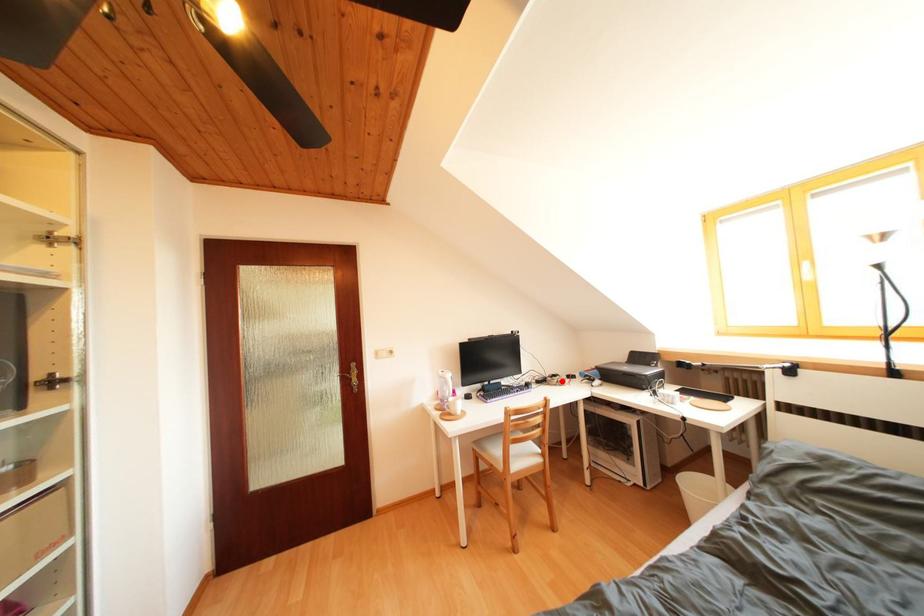
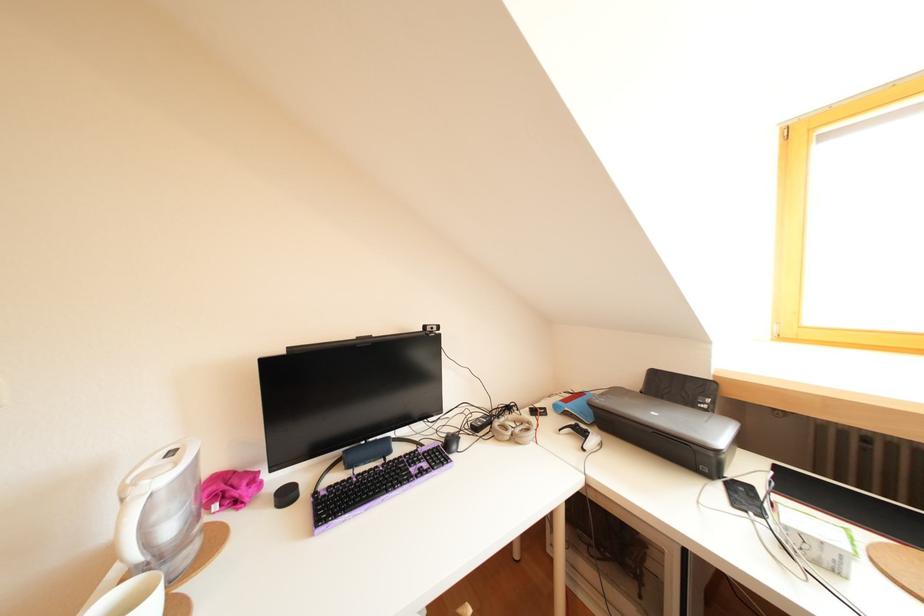
Question: I am providing you with two images of the same scene from different viewpoints. A red point is marked on the first image. At the location where the point appears in image 1, is it still visible in image 2?

Choices:
 (A) Yes
 (B) No

Answer: (A)